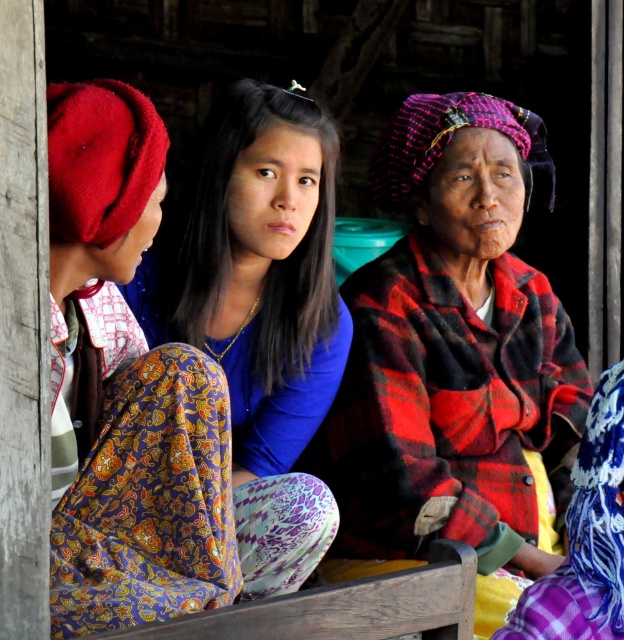
Question: Among these objects, which one is farthest from the camera?

Choices:
 (A) matte blue blouse at center
 (B) plaid fabric shawl at right
 (C) matte red beret at left

Answer: (B)

Question: Is plaid fabric shawl at right smaller than matte blue blouse at center?

Choices:
 (A) yes
 (B) no

Answer: (B)

Question: Does matte red beret at left appear on the right side of matte blue blouse at center?

Choices:
 (A) yes
 (B) no

Answer: (B)

Question: Which object appears closest to the camera in this image?

Choices:
 (A) matte blue blouse at center
 (B) matte red beret at left

Answer: (B)

Question: Which of the following is the farthest from the observer?

Choices:
 (A) matte blue blouse at center
 (B) matte red beret at left

Answer: (A)

Question: Does matte red beret at left have a greater width compared to matte blue blouse at center?

Choices:
 (A) no
 (B) yes

Answer: (A)